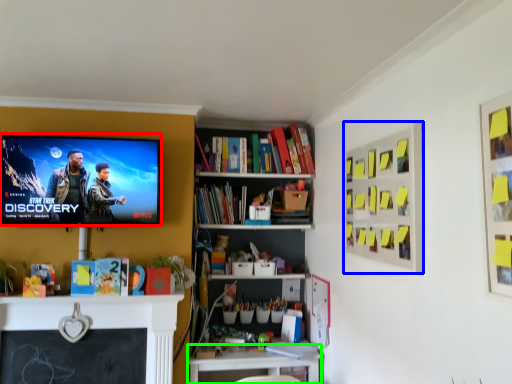
Question: Which object is positioned farthest from television (highlighted by a red box)? Select from bulletin board (highlighted by a blue box) and table (highlighted by a green box).

Choices:
 (A) bulletin board
 (B) table

Answer: (A)